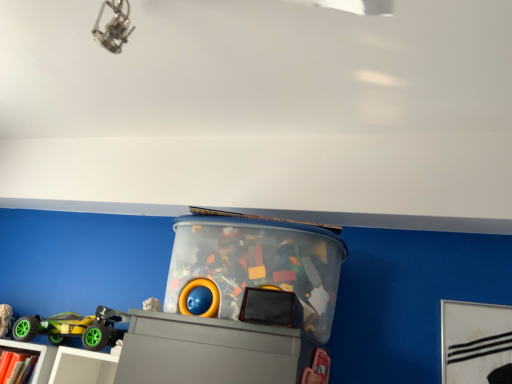
Question: Is green rubber toy car at lower left, which appears as the first toy when viewed from the left, surrounding transparent plastic container at center, the 1th toy when ordered from right to left?

Choices:
 (A) yes
 (B) no

Answer: (B)

Question: Is green rubber toy car at lower left, which appears as the first toy when viewed from the left, to the right of transparent plastic container at center, the 1th toy when ordered from right to left, from the viewer's perspective?

Choices:
 (A) no
 (B) yes

Answer: (A)

Question: Is green rubber toy car at lower left, which appears as the first toy when viewed from the left, closer to the viewer compared to transparent plastic container at center, the 1th toy when ordered from right to left?

Choices:
 (A) no
 (B) yes

Answer: (A)

Question: Can you confirm if green rubber toy car at lower left, which appears as the first toy when viewed from the left, is shorter than transparent plastic container at center, the 1th toy when ordered from right to left?

Choices:
 (A) no
 (B) yes

Answer: (B)

Question: Is green rubber toy car at lower left, placed as the second toy when sorted from right to left, not within transparent plastic container at center, the 1th toy when ordered from right to left?

Choices:
 (A) no
 (B) yes

Answer: (B)

Question: Considering the relative positions of green rubber toy car at lower left, placed as the second toy when sorted from right to left, and transparent plastic container at center, which ranks as the 2th toy in left-to-right order, in the image provided, is green rubber toy car at lower left, placed as the second toy when sorted from right to left, to the left of transparent plastic container at center, which ranks as the 2th toy in left-to-right order, from the viewer's perspective?

Choices:
 (A) no
 (B) yes

Answer: (B)

Question: Does matte white bookcase at lower left have a larger size compared to matte gray shelf at lower left?

Choices:
 (A) no
 (B) yes

Answer: (A)

Question: From a real-world perspective, is matte white bookcase at lower left located higher than matte gray shelf at lower left?

Choices:
 (A) yes
 (B) no

Answer: (B)

Question: Does matte white bookcase at lower left have a smaller size compared to matte gray shelf at lower left?

Choices:
 (A) no
 (B) yes

Answer: (B)

Question: Is matte white bookcase at lower left not inside matte gray shelf at lower left?

Choices:
 (A) yes
 (B) no

Answer: (B)

Question: Can you confirm if matte white bookcase at lower left is positioned to the left of matte gray shelf at lower left?

Choices:
 (A) no
 (B) yes

Answer: (B)

Question: Does matte white bookcase at lower left appear on the right side of matte gray shelf at lower left?

Choices:
 (A) yes
 (B) no

Answer: (B)

Question: Does matte gray shelf at lower left have a lesser height compared to matte white bookcase at lower left?

Choices:
 (A) yes
 (B) no

Answer: (B)